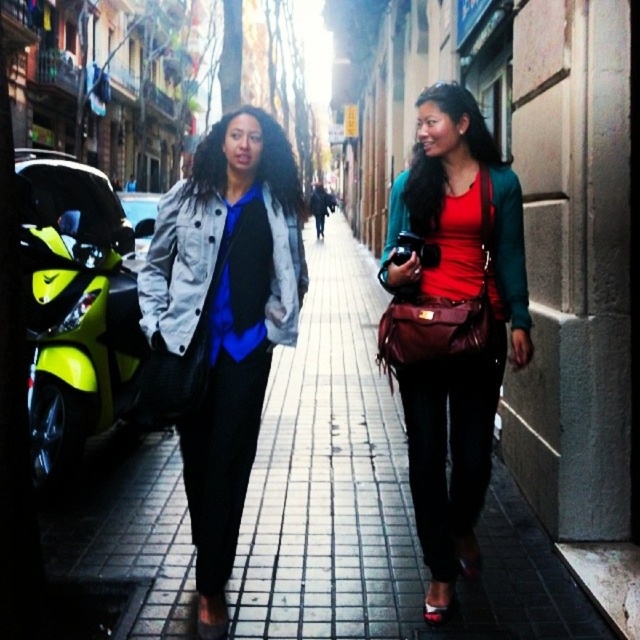
Which is behind, point (280, 228) or point (99, 394)?

The point (99, 394) is behind.

Does matte black jacket at center appear on the left side of neon yellow plastic motorcycle at left?

In fact, matte black jacket at center is to the right of neon yellow plastic motorcycle at left.

Does point (248, 160) come farther from viewer compared to point (88, 257)?

No, (248, 160) is closer to viewer.

Where is `matte black jacket at center`? The image size is (640, 640). matte black jacket at center is located at coordinates pyautogui.click(x=221, y=324).

Can you confirm if brick pavement at center is thinner than matte red leather bag at center?

In fact, brick pavement at center might be wider than matte red leather bag at center.

Is brick pavement at center positioned behind matte red leather bag at center?

Yes, it is.

Does point (390, 550) lie in front of point (477, 484)?

No, (390, 550) is further to viewer.

Identify the location of brick pavement at center. The height and width of the screenshot is (640, 640). (371, 499).

Does matte red leather bag at center have a lesser width compared to matte blue shirt at center?

Yes, matte red leather bag at center is thinner than matte blue shirt at center.

From the picture: Who is more distant from viewer, (449, 596) or (289, 168)?

The point (289, 168) is behind.

This screenshot has height=640, width=640. I want to click on matte red leather bag at center, so tap(451, 321).